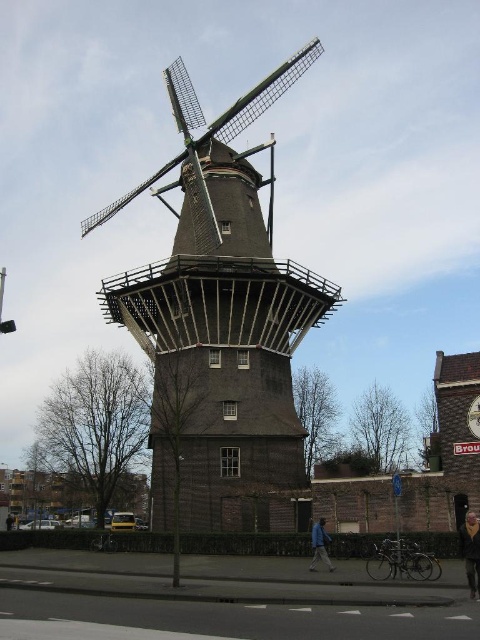
Does dark brown leather jacket at lower right come behind blue fabric jacket at lower center?

No, it is not.

At what (x,y) coordinates should I click in order to perform the action: click on dark brown leather jacket at lower right. Please return your answer as a coordinate pair (x, y). Looking at the image, I should click on (470, 552).

Who is more distant from viewer, (268,294) or (313,544)?

The point (268,294) is behind.

The image size is (480, 640). What are the coordinates of `dark brown wooden windmill at center` in the screenshot? It's located at (218, 317).

Between dark brown wooden windmill at center and dark brown leather jacket at lower right, which one appears on the left side from the viewer's perspective?

dark brown wooden windmill at center

Is point (178, 292) closer to viewer compared to point (468, 576)?

That is False.

Find the location of a particular element. The width and height of the screenshot is (480, 640). dark brown wooden windmill at center is located at coordinates (218, 317).